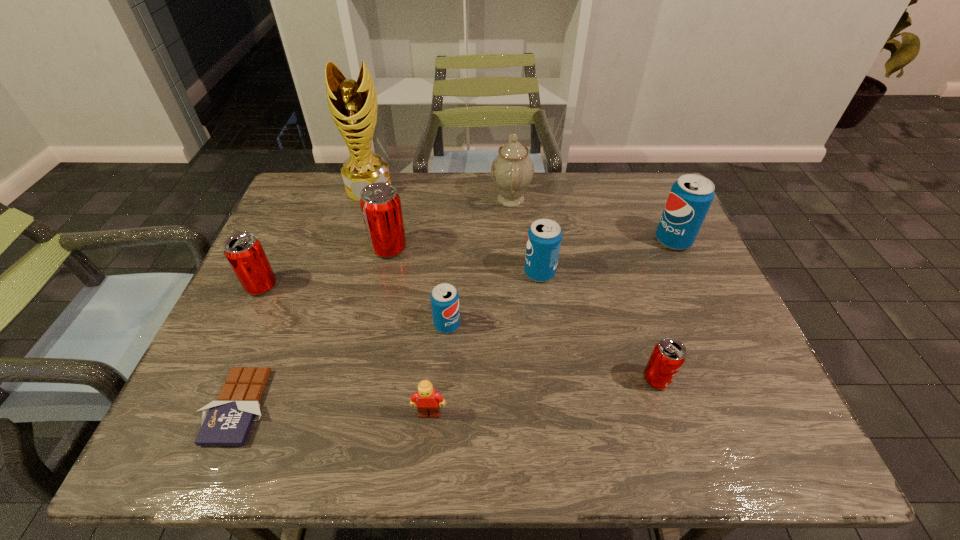
Identify the location of the leftmost soda can. (244, 252).

This screenshot has width=960, height=540. I want to click on the ninth object from left to right, so click(669, 354).

Identify the location of the rightmost red soda can. This screenshot has width=960, height=540. (669, 354).

I want to click on the smallest blue soda can, so click(444, 298).

Where is `the fifth farthest soda can`? the fifth farthest soda can is located at coordinates (444, 298).

Find the location of a particular element. This screenshot has height=540, width=960. Lego is located at coordinates (429, 401).

I want to click on the shortest object, so click(226, 422).

Identify the location of vacant space located 0.050m on the front-facing side of the award. Image resolution: width=960 pixels, height=540 pixels. (362, 212).

Where is `vacant area situated 0.250m on the spout of the chinaware`? This screenshot has height=540, width=960. vacant area situated 0.250m on the spout of the chinaware is located at coordinates (410, 199).

This screenshot has width=960, height=540. I want to click on vacant space located on the spout of the chinaware, so click(x=426, y=199).